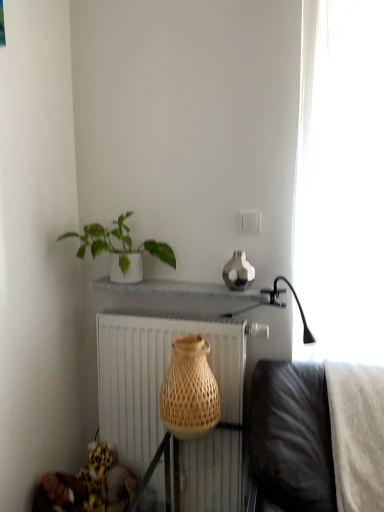
Question: In the image, is white matte radiator at center on the left side or the right side of white ceramic plant at upper left?

Choices:
 (A) left
 (B) right

Answer: (B)

Question: Based on their sizes in the image, would you say white matte radiator at center is bigger or smaller than white ceramic plant at upper left?

Choices:
 (A) big
 (B) small

Answer: (A)

Question: Which object is the farthest from the white matte radiator at center?

Choices:
 (A) white ceramic plant at upper left
 (B) natural woven basket at center
 (C) white sheer curtain at right

Answer: (C)

Question: Which of these objects is positioned closest to the white matte radiator at center?

Choices:
 (A) white sheer curtain at right
 (B) natural woven basket at center
 (C) white ceramic plant at upper left

Answer: (B)